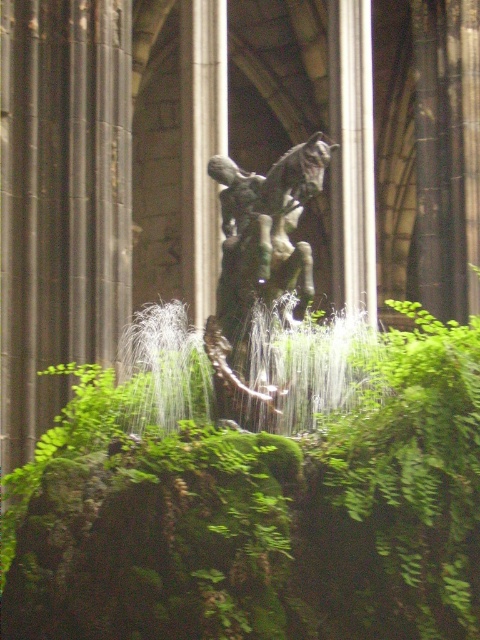
You are standing in the grand architectural setting with columns and the bronze statue. You want to place a small potted fern exactly at the point marked as point (261, 515). What will you find there when you arrive?

At point (261, 515) lies green mossy rock at center, so placing the potted fern there would require removing the existing green mossy rock at center first.

You are an art student sketching the scene from the front. Which object, the green mossy rock at center or the green patina metal horse at center, will appear larger in your drawing if you focus on the center of the image?

The green mossy rock at center will appear larger in your drawing because it is closer to the viewer than the green patina metal horse at center.

You are standing in front of the statue and want to take a photo. There are two points marked on the ground where you can place your tripod. One is at point (112,400) and the other at point (271,426). Which point is closer to you?

Point (112,400) is closer to you because it is further to the camera than point (271,426).